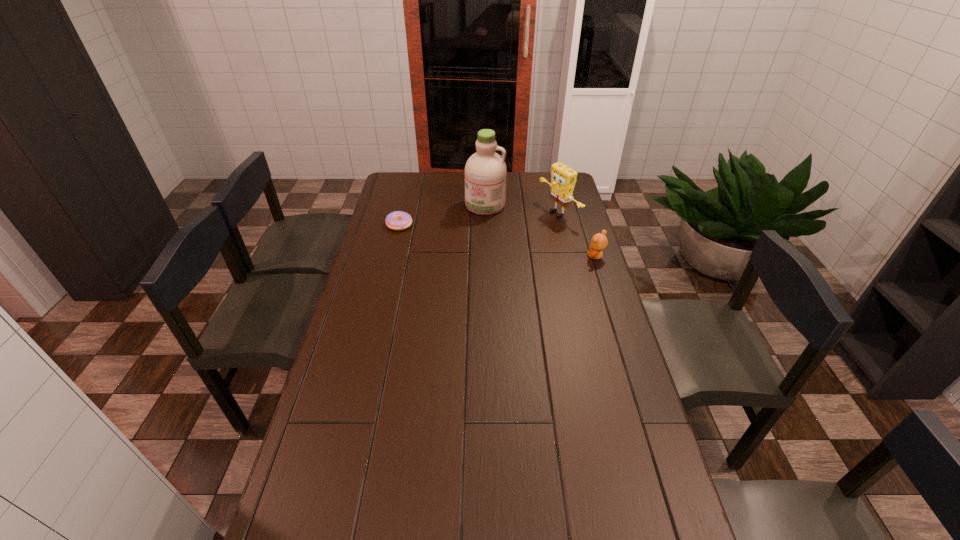
Locate an element on the screen. sponge present at the right edge is located at coordinates (563, 179).

The height and width of the screenshot is (540, 960). Find the location of `vacant space at the far edge of the desktop`. vacant space at the far edge of the desktop is located at coordinates (534, 189).

Where is `free space at the near edge of the desktop`? free space at the near edge of the desktop is located at coordinates [x=557, y=512].

The image size is (960, 540). In order to click on vacant point at the left edge in this screenshot , I will do `click(372, 231)`.

In order to click on vacant space at the right edge of the desktop in this screenshot , I will do `click(583, 382)`.

You are a GUI agent. You are given a task and a screenshot of the screen. Output one action in this format:
    pyautogui.click(x=<x>, y=<y>)
    Task: Click on the vacant space at the near left corner of the desktop
    
    Given the screenshot: What is the action you would take?
    pyautogui.click(x=311, y=532)

What are the coordinates of `empty space that is in between the third object from right to left and the third shortest object` in the screenshot? It's located at (522, 209).

What are the coordinates of `vacant space that's between the doughnut and the second object from left to right` in the screenshot? It's located at (443, 215).

You are a GUI agent. You are given a task and a screenshot of the screen. Output one action in this format:
    pyautogui.click(x=<x>, y=<y>)
    Task: Click on the vacant area that lies between the cleansing agent and the leftmost object
    This screenshot has height=540, width=960.
    Given the screenshot: What is the action you would take?
    pyautogui.click(x=443, y=215)

This screenshot has height=540, width=960. Find the location of `free space between the third object from right to left and the nearest object`. free space between the third object from right to left and the nearest object is located at coordinates (540, 231).